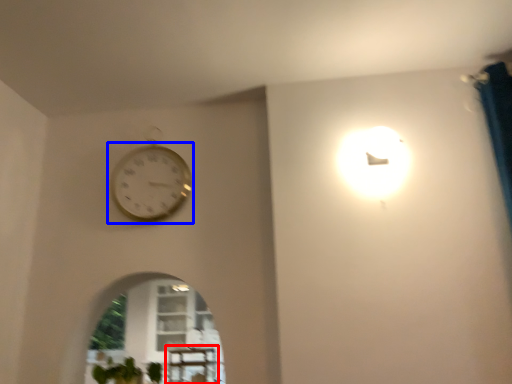
Question: Which object appears closest to the camera in this image, table (highlighted by a red box) or wall clock (highlighted by a blue box)?

Choices:
 (A) table
 (B) wall clock

Answer: (A)